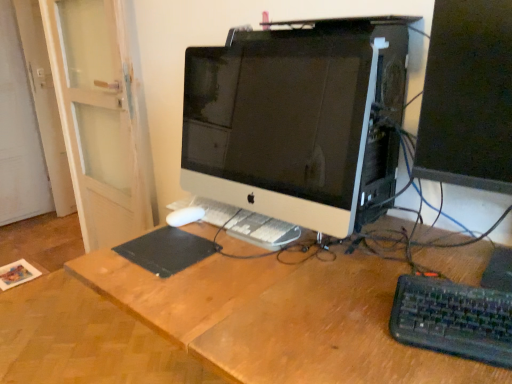
Question: From a real-world perspective, is wooden desk at center physically located above or below black plastic keyboard at lower right?

Choices:
 (A) below
 (B) above

Answer: (A)

Question: Relative to black plastic keyboard at lower right, is wooden desk at center in front or behind?

Choices:
 (A) front
 (B) behind

Answer: (A)

Question: Which object is positioned farthest from the white glossy computer monitor at center, which is counted as the 2th computer monitor, starting from the right?

Choices:
 (A) white plastic keyboard at center
 (B) wooden desk at center
 (C) matte black monitor at right, the 2th computer monitor from the left
 (D) black plastic keyboard at lower right
 (E) black matte mousepad at center

Answer: (D)

Question: Considering the real-world distances, which object is closest to the wooden desk at center?

Choices:
 (A) white plastic keyboard at center
 (B) black matte mousepad at center
 (C) black plastic keyboard at lower right
 (D) white glossy computer monitor at center, which is counted as the 2th computer monitor, starting from the right
 (E) matte black monitor at right, which is counted as the first computer monitor, starting from the right

Answer: (A)